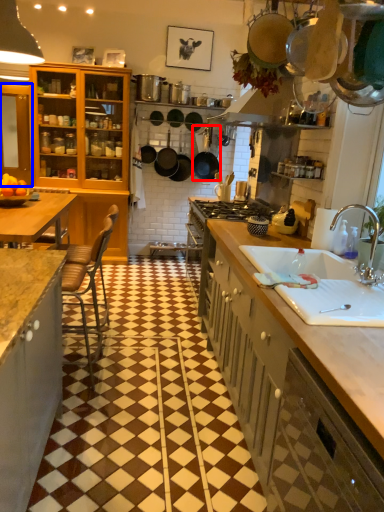
Question: Which object appears farthest to the camera in this image, kitchen appliance (highlighted by a red box) or cabinetry (highlighted by a blue box)?

Choices:
 (A) kitchen appliance
 (B) cabinetry

Answer: (A)